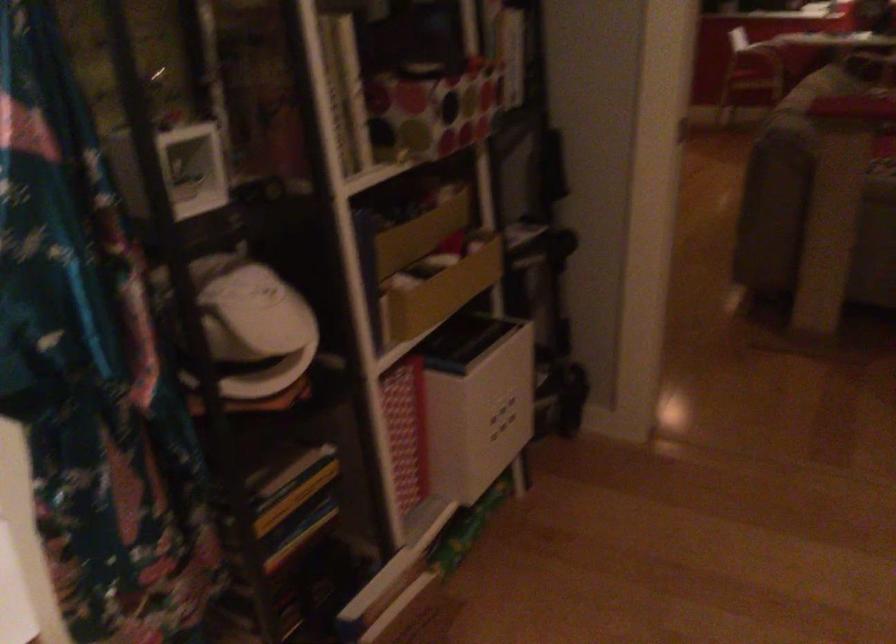
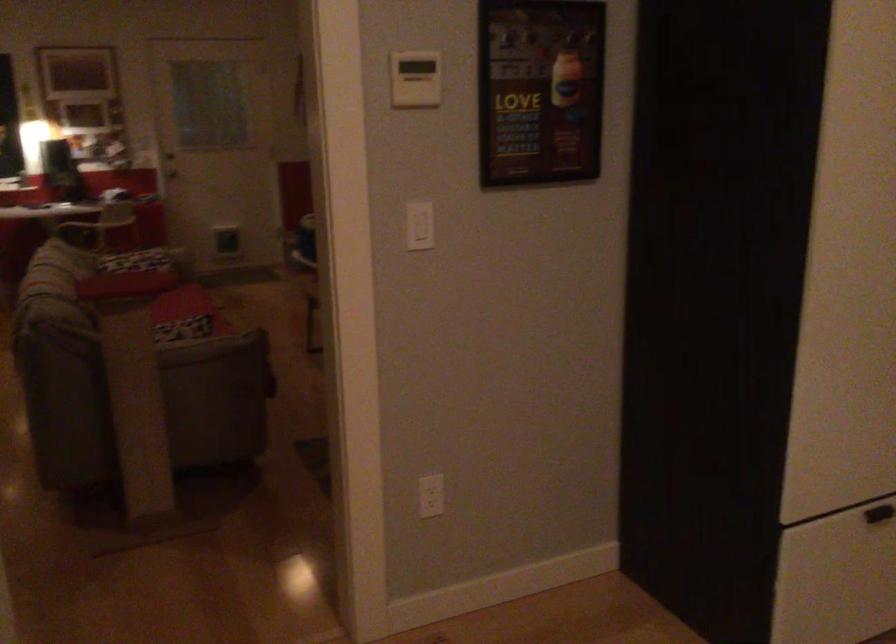
Question: The first image is from the beginning of the video and the second image is from the end. How did the camera likely rotate when shooting the video?

Choices:
 (A) Left
 (B) Right
 (C) Up
 (D) Down

Answer: (B)